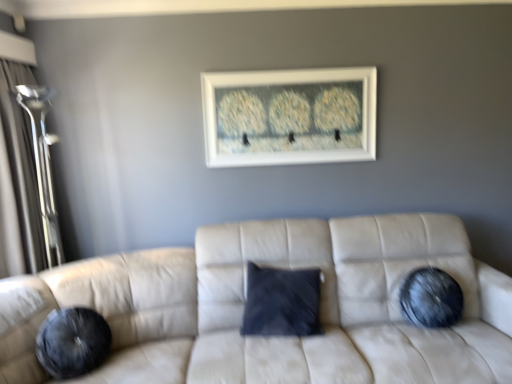
Question: Relative to velvety black pillow at right, is transparent glass door at left in front or behind?

Choices:
 (A) front
 (B) behind

Answer: (A)

Question: In terms of width, does transparent glass door at left look wider or thinner when compared to velvety black pillow at right?

Choices:
 (A) wide
 (B) thin

Answer: (A)

Question: Which object is the closest to the white matte picture frame at upper center?

Choices:
 (A) suede beige couch at center
 (B) velvety black pillow at right
 (C) transparent glass door at left

Answer: (A)

Question: Which of these objects is positioned farthest from the transparent glass door at left?

Choices:
 (A) velvety black pillow at right
 (B) white matte picture frame at upper center
 (C) suede beige couch at center

Answer: (A)